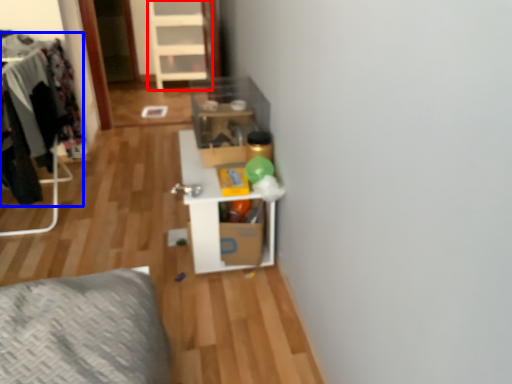
Question: Which point is further to the camera, dresser (highlighted by a red box) or clothing (highlighted by a blue box)?

Choices:
 (A) dresser
 (B) clothing

Answer: (A)